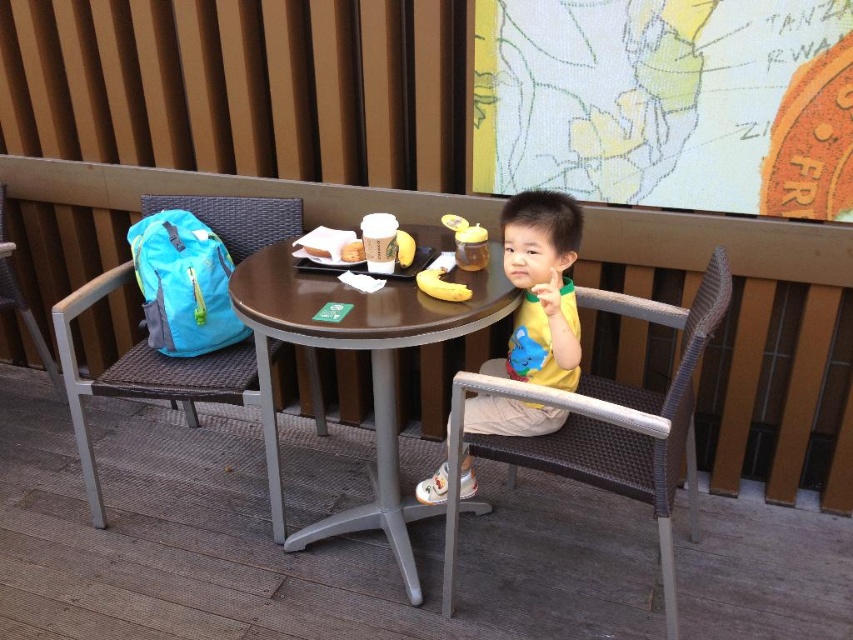
Does teal fabric chair at left have a larger size compared to blue fabric backpack at left?

Correct, teal fabric chair at left is larger in size than blue fabric backpack at left.

Does teal fabric chair at left have a lesser width compared to blue fabric backpack at left?

No.

Is point (271, 236) less distant than point (291, 228)?

No, (271, 236) is further to viewer.

Locate an element on the screen. The width and height of the screenshot is (853, 640). teal fabric chair at left is located at coordinates (144, 376).

Is brown wooden table at center below blue fabric backpack at left?

Indeed, brown wooden table at center is positioned under blue fabric backpack at left.

Between brown wooden table at center and blue fabric backpack at left, which one appears on the left side from the viewer's perspective?

From the viewer's perspective, blue fabric backpack at left appears more on the left side.

Is point (256, 340) farther from viewer compared to point (224, 200)?

No, (256, 340) is in front of (224, 200).

Locate an element on the screen. This screenshot has height=640, width=853. brown wooden table at center is located at coordinates (370, 371).

Is brown wooden table at center to the right of yellow matte shirt at center from the viewer's perspective?

In fact, brown wooden table at center is to the left of yellow matte shirt at center.

Locate an element on the screen. This screenshot has height=640, width=853. brown wooden table at center is located at coordinates (370, 371).

Where is `brown wooden table at center`? This screenshot has width=853, height=640. brown wooden table at center is located at coordinates (370, 371).